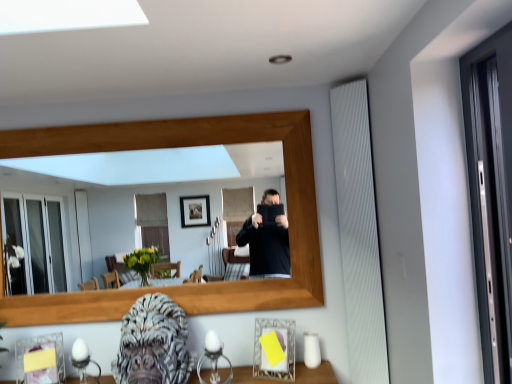
Question: Which is correct: wooden frame at center is inside yellow paper at lower left, which is the 2th picture frame from right to left, or outside of it?

Choices:
 (A) outside
 (B) inside

Answer: (A)

Question: From the image's perspective, relative to yellow paper at lower left, which is the 2th picture frame from right to left, is wooden frame at center above or below?

Choices:
 (A) below
 (B) above

Answer: (B)

Question: Which of these objects is positioned farthest from the yellow paper at lower left, which is counted as the first picture frame, starting from the left?

Choices:
 (A) matte glass picture frame at lower right, which is counted as the 1th picture frame, starting from the right
 (B) wooden frame at center
 (C) gray textured gorilla head at lower center

Answer: (B)

Question: Estimate the real-world distances between objects in this image. Which object is closer to the yellow paper at lower left, which is counted as the first picture frame, starting from the left?

Choices:
 (A) wooden frame at center
 (B) matte glass picture frame at lower right, which is counted as the 2th picture frame, starting from the left
 (C) gray textured gorilla head at lower center

Answer: (C)